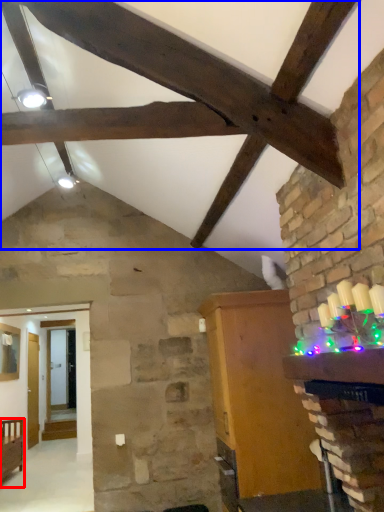
Question: Which point is closer to the camera, furniture (highlighted by a red box) or exhaust hood (highlighted by a blue box)?

Choices:
 (A) furniture
 (B) exhaust hood

Answer: (B)